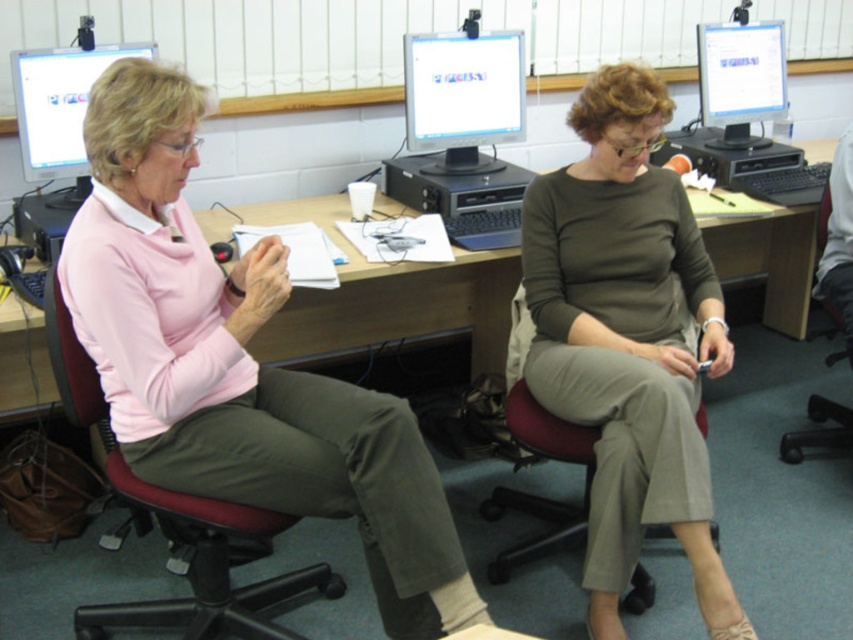
You are trying to place a new keyboard that requires 30 cm of space on the wooden desk at center. The matte black monitor at upper left is already occupying some space. Can the keyboard fit on the desk without moving the monitor?

The wooden desk at center is wider than the matte black monitor at upper left, so there should be enough space to place the keyboard next to the monitor without moving it.